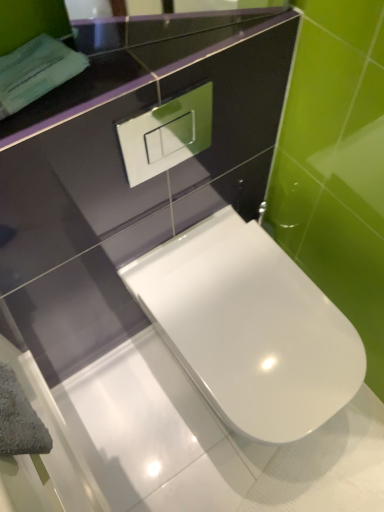
Question: From their relative heights in the image, would you say glossy black mirror at upper center is taller or shorter than white glossy toilet at center?

Choices:
 (A) short
 (B) tall

Answer: (A)

Question: Is glossy black mirror at upper center in front of or behind white glossy toilet at center in the image?

Choices:
 (A) behind
 (B) front

Answer: (B)

Question: Is glossy black mirror at upper center bigger or smaller than white glossy toilet at center?

Choices:
 (A) big
 (B) small

Answer: (B)

Question: From a real-world perspective, is white glossy toilet at center above or below glossy black mirror at upper center?

Choices:
 (A) below
 (B) above

Answer: (A)

Question: Is white glossy toilet at center wider or thinner than glossy black mirror at upper center?

Choices:
 (A) wide
 (B) thin

Answer: (A)

Question: Considering their positions, is white glossy toilet at center located in front of or behind glossy black mirror at upper center?

Choices:
 (A) behind
 (B) front

Answer: (A)

Question: In the image, is white glossy toilet at center on the left side or the right side of glossy black mirror at upper center?

Choices:
 (A) left
 (B) right

Answer: (B)